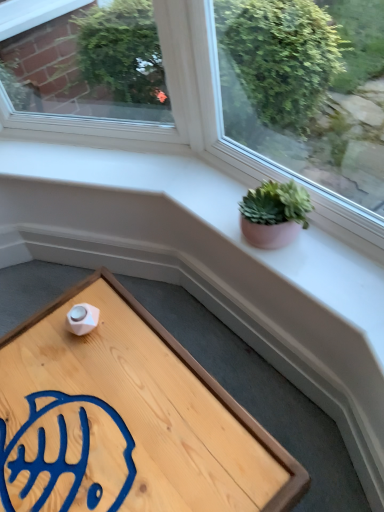
Question: In terms of width, does green succulent in clay pot at upper right look wider or thinner when compared to wooden tray at lower left?

Choices:
 (A) thin
 (B) wide

Answer: (A)

Question: From a real-world perspective, is green succulent in clay pot at upper right physically located above or below wooden tray at lower left?

Choices:
 (A) above
 (B) below

Answer: (A)

Question: Which is correct: green succulent in clay pot at upper right is inside wooden tray at lower left, or outside of it?

Choices:
 (A) inside
 (B) outside

Answer: (B)

Question: Is wooden tray at lower left situated inside green succulent in clay pot at upper right or outside?

Choices:
 (A) inside
 (B) outside

Answer: (B)

Question: Based on their sizes in the image, would you say wooden tray at lower left is bigger or smaller than green succulent in clay pot at upper right?

Choices:
 (A) big
 (B) small

Answer: (A)

Question: In terms of width, does wooden tray at lower left look wider or thinner when compared to green succulent in clay pot at upper right?

Choices:
 (A) wide
 (B) thin

Answer: (A)

Question: From a real-world perspective, is wooden tray at lower left physically located above or below green succulent in clay pot at upper right?

Choices:
 (A) below
 (B) above

Answer: (A)